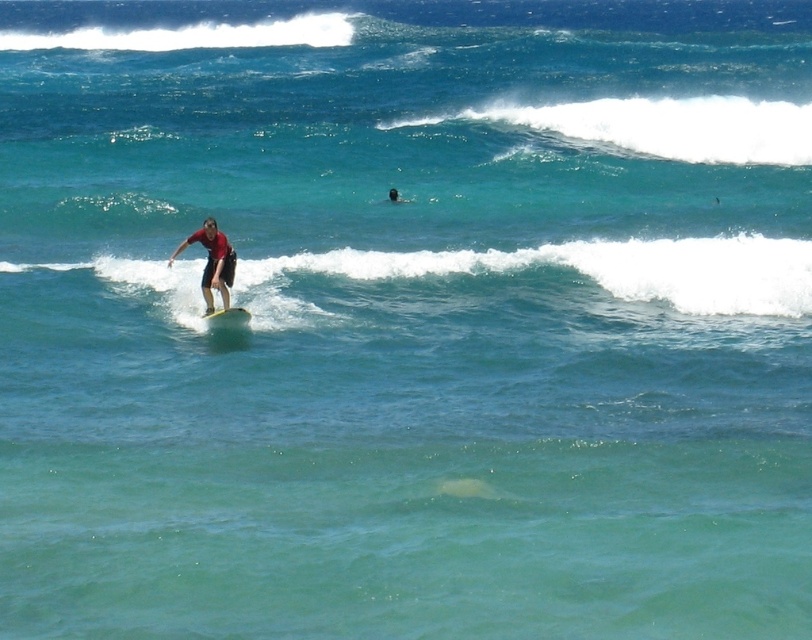
Does matte red shirt at center have a greater height compared to white foam surfboard at center?

Result: Indeed, matte red shirt at center has a greater height compared to white foam surfboard at center.

Who is shorter, matte red shirt at center or white foam surfboard at center?

white foam surfboard at center is shorter.

Is point (223, 256) farther from viewer compared to point (204, 317)?

No.

Where is `matte red shirt at center`? This screenshot has height=640, width=812. matte red shirt at center is located at coordinates (212, 262).

Is white foamy wave at center thinner than matte red shirt at center?

No, white foamy wave at center is not thinner than matte red shirt at center.

Can you confirm if white foamy wave at center is positioned to the right of matte red shirt at center?

Indeed, white foamy wave at center is positioned on the right side of matte red shirt at center.

Who is more distant from viewer, (767, 285) or (229, 259)?

Point (767, 285)

Identify the location of white foamy wave at center. (594, 269).

Does white foamy wave at center have a smaller size compared to white foam surfboard at center?

No.

Does point (763, 250) come closer to viewer compared to point (227, 308)?

No, it is behind (227, 308).

Which is behind, point (586, 266) or point (240, 324)?

Positioned behind is point (586, 266).

Identify the location of white foamy wave at center. (594, 269).